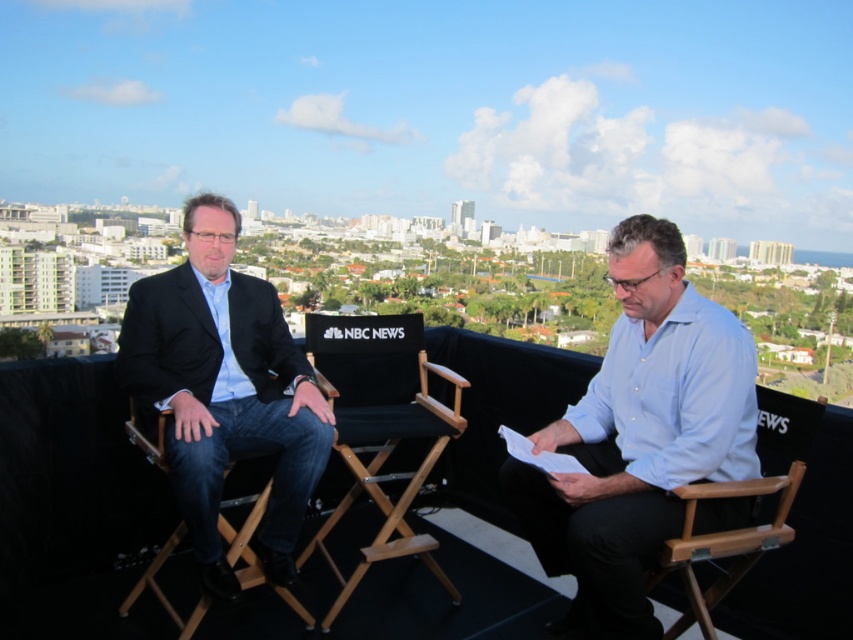
Is wooden folding chair at right positioned behind wooden director's chair at left?

Yes, it is behind wooden director's chair at left.

The width and height of the screenshot is (853, 640). Identify the location of wooden folding chair at right. (741, 529).

You are a GUI agent. You are given a task and a screenshot of the screen. Output one action in this format:
    pyautogui.click(x=<x>, y=<y>)
    Task: Click on the wooden folding chair at right
    This screenshot has height=640, width=853.
    Given the screenshot: What is the action you would take?
    pyautogui.click(x=741, y=529)

Can you confirm if light blue shirt at center is smaller than black fabric chair at center?

Incorrect, light blue shirt at center is not smaller in size than black fabric chair at center.

Which is more to the left, light blue shirt at center or black fabric chair at center?

black fabric chair at center is more to the left.

Which is in front, point (521, 508) or point (344, 326)?

Positioned in front is point (521, 508).

This screenshot has width=853, height=640. I want to click on light blue shirt at center, so click(x=637, y=436).

Does matte black suit at left appear on the right side of wooden director's chair at left?

Correct, you'll find matte black suit at left to the right of wooden director's chair at left.

Is matte black suit at left below wooden director's chair at left?

No.

Is point (231, 390) positioned after point (258, 497)?

Yes, it is behind point (258, 497).

Image resolution: width=853 pixels, height=640 pixels. I want to click on matte black suit at left, so click(224, 388).